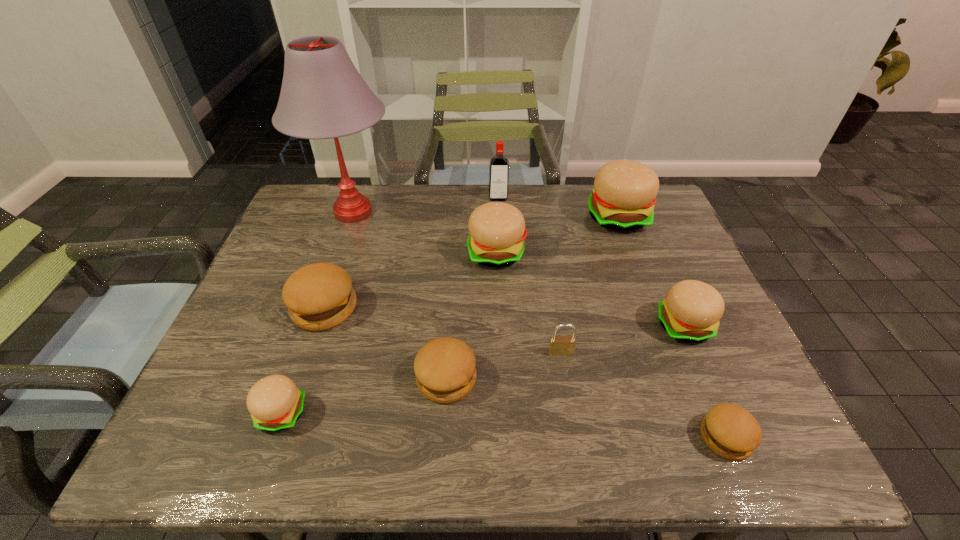
Where is `the seventh object from left to right`? the seventh object from left to right is located at coordinates (558, 345).

What are the coordinates of `padlock` in the screenshot? It's located at tap(558, 345).

Find the location of a particular element. The width and height of the screenshot is (960, 540). the second farthest brown hamburger is located at coordinates (445, 368).

In order to click on the second smallest brown hamburger in this screenshot , I will do `click(445, 368)`.

This screenshot has height=540, width=960. I want to click on the nearest beige hamburger, so click(x=275, y=403).

Locate an element on the screen. The height and width of the screenshot is (540, 960). the leftmost beige hamburger is located at coordinates (275, 403).

You are a GUI agent. You are given a task and a screenshot of the screen. Output one action in this format:
    pyautogui.click(x=<x>, y=<y>)
    Task: Click on the shortest hamburger
    This screenshot has height=540, width=960.
    Given the screenshot: What is the action you would take?
    pyautogui.click(x=730, y=431)

Identify the location of the shortest object. Image resolution: width=960 pixels, height=540 pixels. (730, 431).

The width and height of the screenshot is (960, 540). Identify the location of vacant space located on the front-facing side of the tallest object. (324, 293).

Locate an element on the screen. Image resolution: width=960 pixels, height=540 pixels. free point located on the front and back of the vodka is located at coordinates (501, 255).